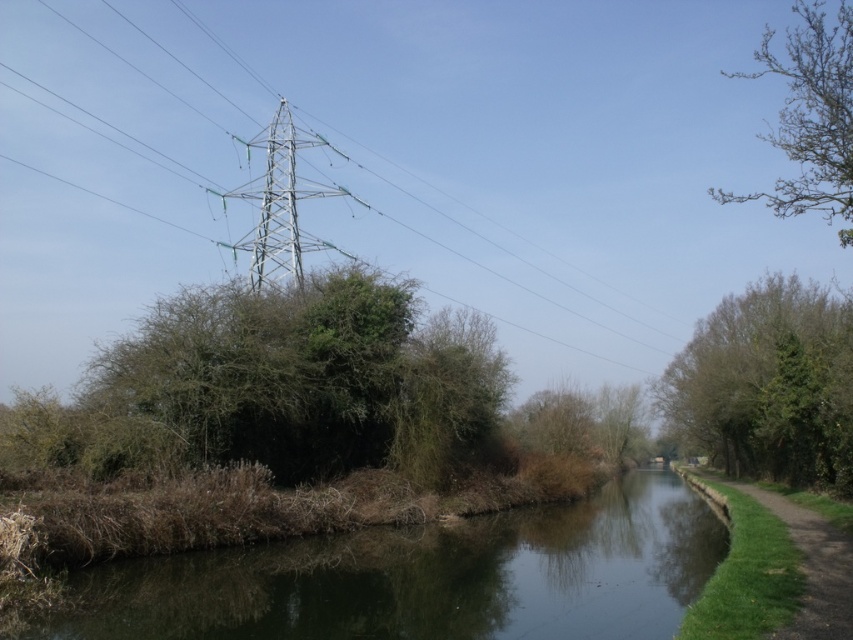
Question: Estimate the real-world distances between objects in this image. Which object is closer to the metallic silver power line at upper center?

Choices:
 (A) green grassy river at center
 (B) bare branches at upper right
 (C) metallic silver tower at center

Answer: (C)

Question: Which object is farther from the camera taking this photo?

Choices:
 (A) green grassy path at lower right
 (B) green leafy tree at right
 (C) metallic silver power line at upper center
 (D) brown matte tree at center

Answer: (D)

Question: Is green grassy path at lower right below metallic silver tower at center?

Choices:
 (A) no
 (B) yes

Answer: (B)

Question: Is green leafy tree at right further to camera compared to bare branches at upper right?

Choices:
 (A) no
 (B) yes

Answer: (B)

Question: Can you confirm if green grassy river at center is thinner than metallic silver tower at center?

Choices:
 (A) yes
 (B) no

Answer: (A)

Question: Which of the following is the farthest from the observer?

Choices:
 (A) (277, 257)
 (B) (770, 198)

Answer: (B)